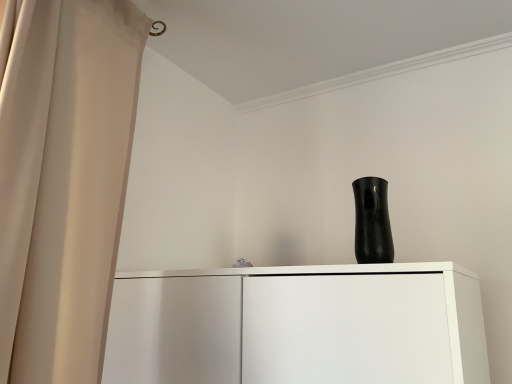
Question: Considering the relative positions of black glossy vase at upper center and beige fabric curtain at left in the image provided, is black glossy vase at upper center to the left or to the right of beige fabric curtain at left?

Choices:
 (A) right
 (B) left

Answer: (A)

Question: Is black glossy vase at upper center bigger or smaller than beige fabric curtain at left?

Choices:
 (A) small
 (B) big

Answer: (A)

Question: Is black glossy vase at upper center inside or outside of beige fabric curtain at left?

Choices:
 (A) outside
 (B) inside

Answer: (A)

Question: Is point (52, 187) positioned closer to the camera than point (356, 201)?

Choices:
 (A) farther
 (B) closer

Answer: (B)

Question: Considering their positions, is beige fabric curtain at left located in front of or behind black glossy vase at upper center?

Choices:
 (A) behind
 (B) front

Answer: (B)

Question: From a real-world perspective, is beige fabric curtain at left above or below black glossy vase at upper center?

Choices:
 (A) above
 (B) below

Answer: (A)

Question: Do you think beige fabric curtain at left is within black glossy vase at upper center, or outside of it?

Choices:
 (A) outside
 (B) inside

Answer: (A)